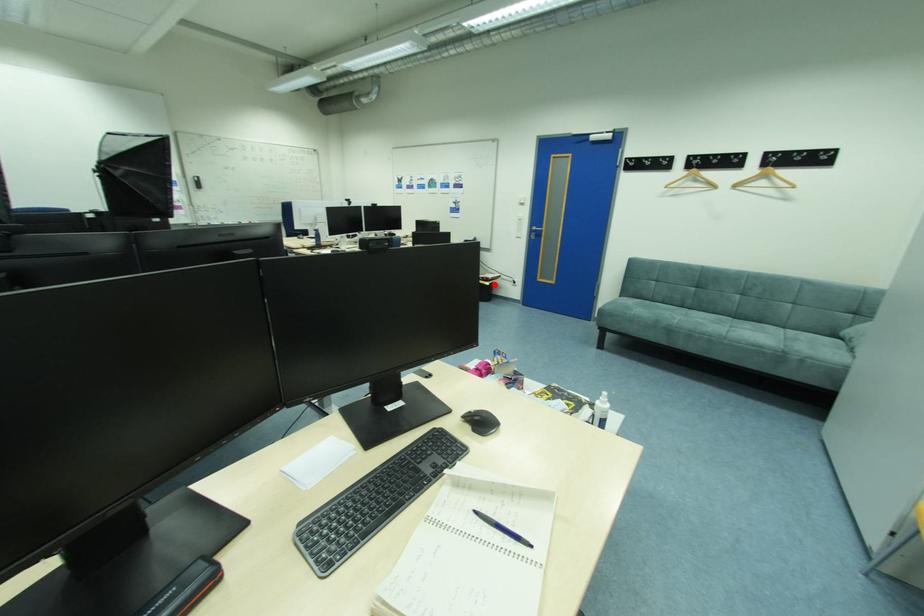
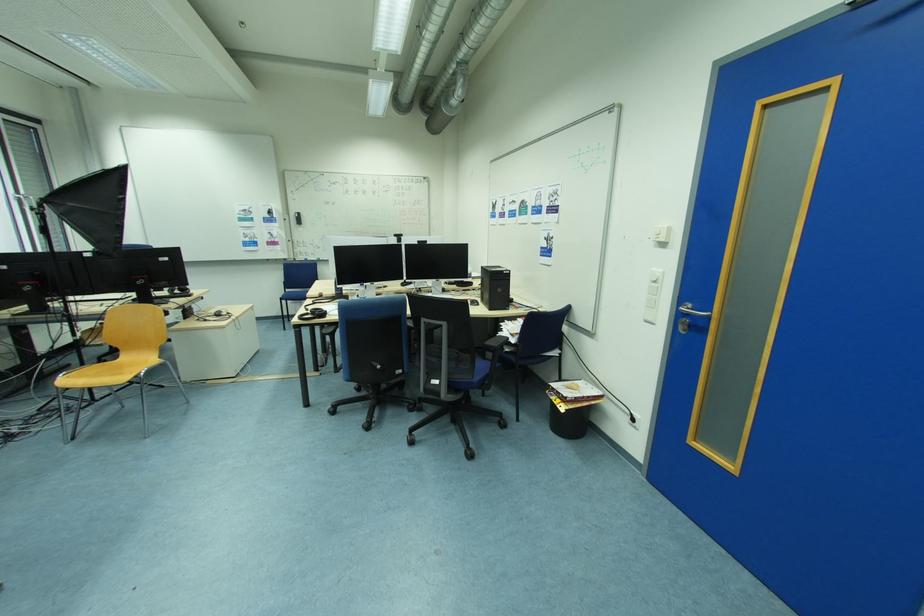
Question: I am providing you with two images of the same scene from different viewpoints. A red point is marked on the first image. Can you still see the location of the red point in image 2?

Choices:
 (A) Yes
 (B) No

Answer: (A)